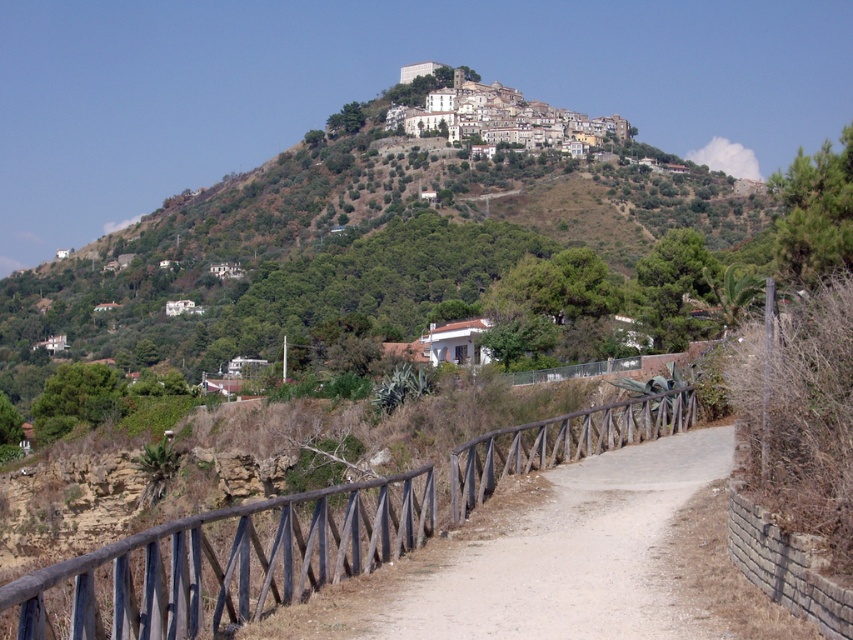
Is brown wooden rail at center smaller than dirt path at center?

No.

Does brown wooden rail at center appear over dirt path at center?

Yes, brown wooden rail at center is above dirt path at center.

You are a GUI agent. You are given a task and a screenshot of the screen. Output one action in this format:
    pyautogui.click(x=<x>, y=<y>)
    Task: Click on the brown wooden rail at center
    
    Given the screenshot: What is the action you would take?
    pyautogui.click(x=225, y=561)